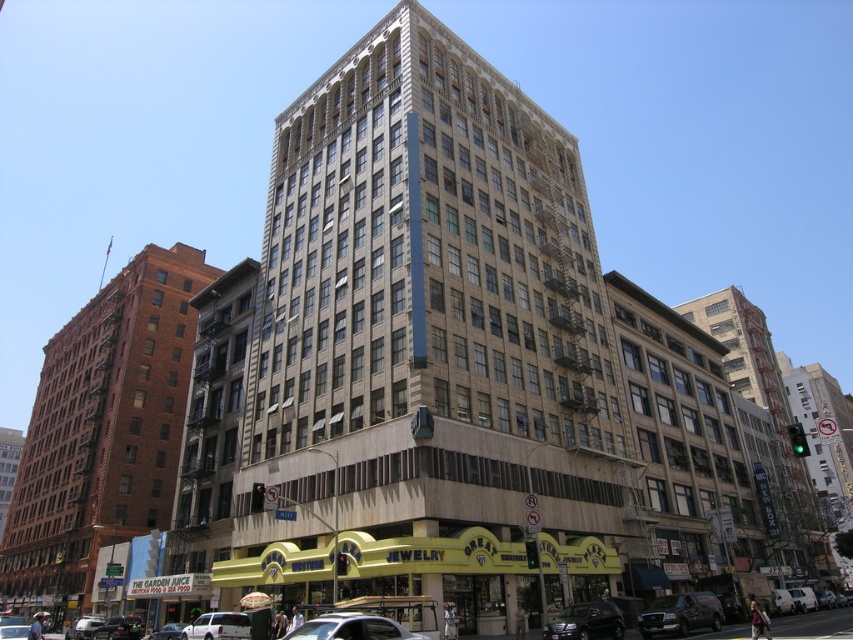
Question: Based on their relative distances, which object is farther from the shiny black sedan at lower left?

Choices:
 (A) silver metallic car at lower left
 (B) silver metallic car at center
 (C) shiny black sedan at center

Answer: (B)

Question: Among these points, which one is nearest to the camera?

Choices:
 (A) (91, 630)
 (B) (692, 621)
 (C) (177, 637)
 (D) (514, 368)

Answer: (B)

Question: Which of the following is the closest to the observer?

Choices:
 (A) shiny black suv at lower center
 (B) beige stone building at center

Answer: (A)

Question: Does red brick building at left have a larger size compared to shiny black van at lower right?

Choices:
 (A) no
 (B) yes

Answer: (B)

Question: Does shiny black sedan at lower left appear on the right side of silver metallic car at lower left?

Choices:
 (A) no
 (B) yes

Answer: (B)

Question: Considering the relative positions of red brick building at left and silver metallic car at center in the image provided, where is red brick building at left located with respect to silver metallic car at center?

Choices:
 (A) below
 (B) above

Answer: (A)